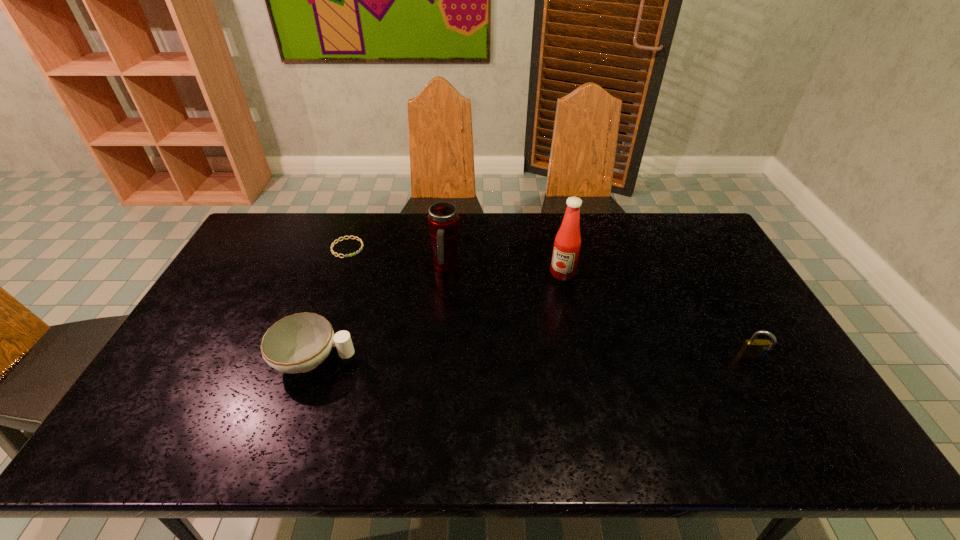
The image size is (960, 540). Find the location of `free space between the shortest object and the padlock`. free space between the shortest object and the padlock is located at coordinates pos(550,303).

Locate an element on the screen. The image size is (960, 540). vacant space that's between the third object from right to left and the bracelet is located at coordinates (396, 258).

The height and width of the screenshot is (540, 960). Find the location of `empty location between the second object from right to left and the rightmost object`. empty location between the second object from right to left and the rightmost object is located at coordinates (658, 316).

At what (x,y) coordinates should I click in order to perform the action: click on vacant area between the fourth tallest object and the padlock. Please return your answer as a coordinate pair (x, y). Looking at the image, I should click on (534, 359).

This screenshot has width=960, height=540. In order to click on free space that is in between the padlock and the fourth shortest object in this screenshot , I will do `click(599, 314)`.

At what (x,y) coordinates should I click in order to perform the action: click on empty location between the condiment and the third object from right to left. Please return your answer as a coordinate pair (x, y). This screenshot has height=540, width=960. Looking at the image, I should click on (504, 271).

Find the location of a particular element. This screenshot has height=540, width=960. the second closest object to the condiment is located at coordinates (754, 348).

At what (x,y) coordinates should I click in order to perform the action: click on object that is the fourth nearest to the shortest object. Please return your answer as a coordinate pair (x, y). The image size is (960, 540). Looking at the image, I should click on (754, 348).

The width and height of the screenshot is (960, 540). Find the location of `free point that satisfies the following two spatial constraints: 1. on the front side of the thermos bottle; 2. on the left side of the shortest object`. free point that satisfies the following two spatial constraints: 1. on the front side of the thermos bottle; 2. on the left side of the shortest object is located at coordinates (340, 268).

The image size is (960, 540). Find the location of `free space that satisfies the following two spatial constraints: 1. on the front side of the bracelet; 2. on the side with the handle of the chinaware`. free space that satisfies the following two spatial constraints: 1. on the front side of the bracelet; 2. on the side with the handle of the chinaware is located at coordinates (307, 360).